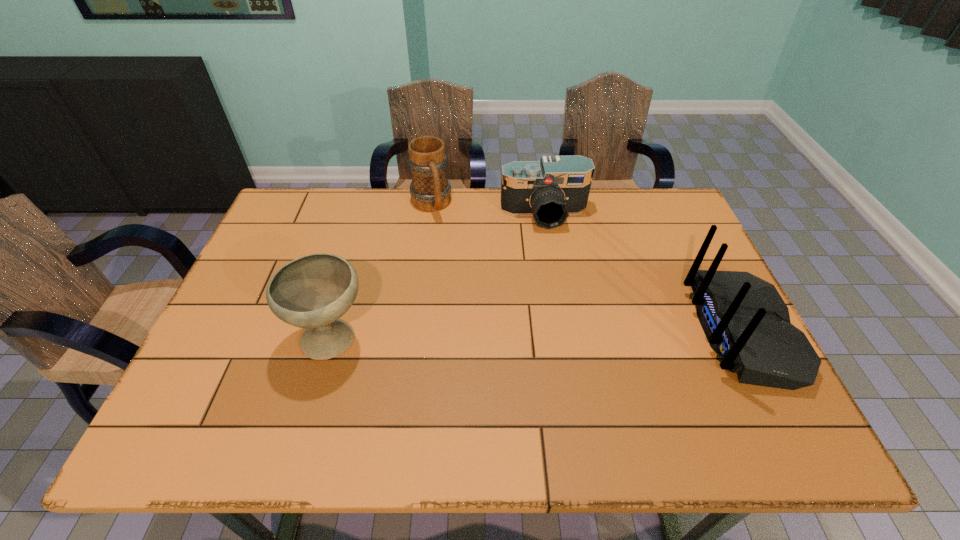
At what (x,y) coordinates should I click in order to perform the action: click on vacant point located on the front-facing side of the camera. Please return your answer as a coordinate pair (x, y). Looking at the image, I should click on (560, 286).

At what (x,y) coordinates should I click in order to perform the action: click on free region located 0.160m on the front-facing side of the camera. Please return your answer as a coordinate pair (x, y). Looking at the image, I should click on (556, 268).

Find the location of a particular element. The width and height of the screenshot is (960, 540). free space located on the side of the second object from left to right with the handle is located at coordinates (449, 254).

Locate an element on the screen. This screenshot has height=540, width=960. vacant area situated 0.310m on the side of the second object from left to right with the handle is located at coordinates (465, 289).

You are a GUI agent. You are given a task and a screenshot of the screen. Output one action in this format:
    pyautogui.click(x=<x>, y=<y>)
    Task: Click on the vacant area situated 0.390m on the side of the second object from left to right with the handle
    
    Given the screenshot: What is the action you would take?
    pyautogui.click(x=474, y=311)

The image size is (960, 540). I want to click on camera at the far edge, so click(x=550, y=190).

The image size is (960, 540). I want to click on mug located in the far edge section of the desktop, so click(x=430, y=190).

I want to click on chalice that is at the near edge, so click(312, 292).

The height and width of the screenshot is (540, 960). What are the coordinates of `router located at the near edge` in the screenshot? It's located at (745, 320).

Locate an element on the screen. Image resolution: width=960 pixels, height=540 pixels. object present at the right edge is located at coordinates pyautogui.click(x=745, y=320).